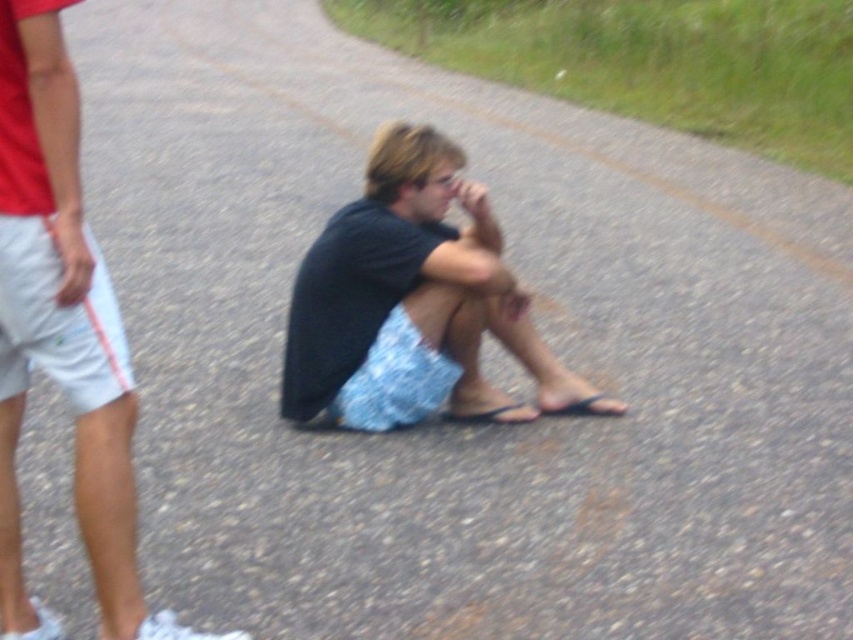
Does matte black shirt at center have a greater height compared to dark gray fabric shorts at center?

Correct, matte black shirt at center is much taller as dark gray fabric shorts at center.

Consider the image. Can you confirm if matte black shirt at center is positioned above dark gray fabric shorts at center?

Incorrect, matte black shirt at center is not positioned above dark gray fabric shorts at center.

Which is behind, point (1, 296) or point (482, 212)?

Point (482, 212)

This screenshot has width=853, height=640. What are the coordinates of `matte black shirt at center` in the screenshot? It's located at (62, 332).